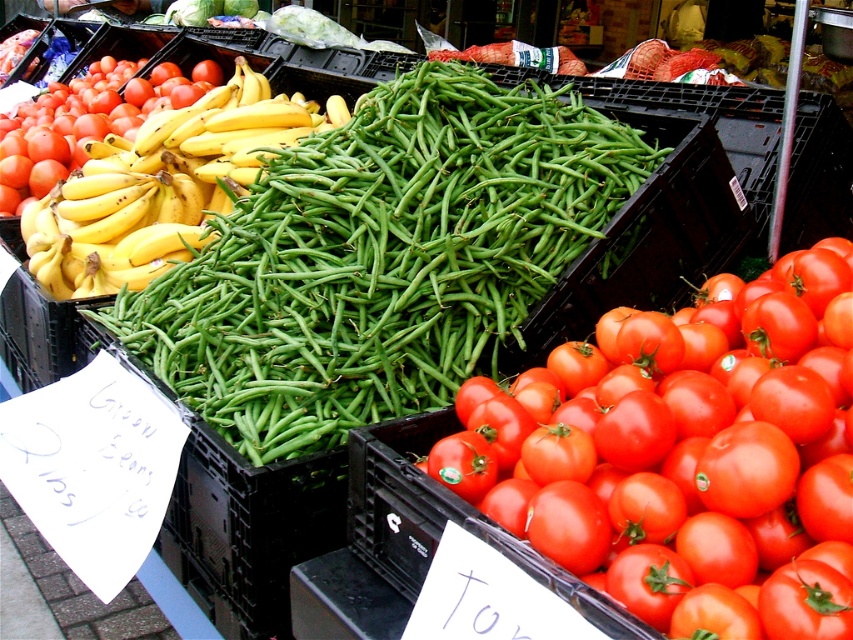
You are a customer at the market stall. You want to pick up the shiny red tomato at center right but need to reach it without moving the green matte beans at center. Is this possible?

The shiny red tomato at center right is behind the green matte beans at center, so you can reach it by moving around the side of the green matte beans at center to access the tomato without disturbing them.